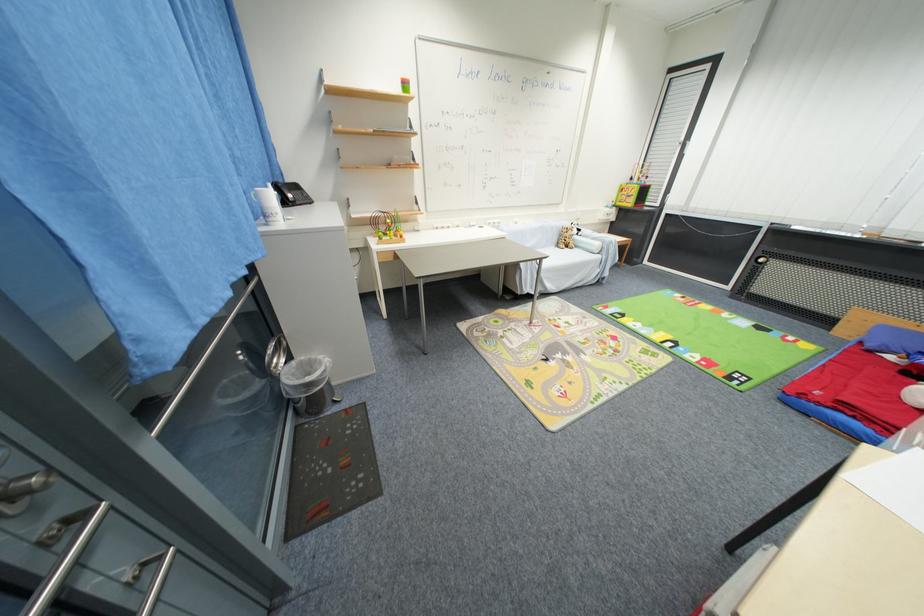
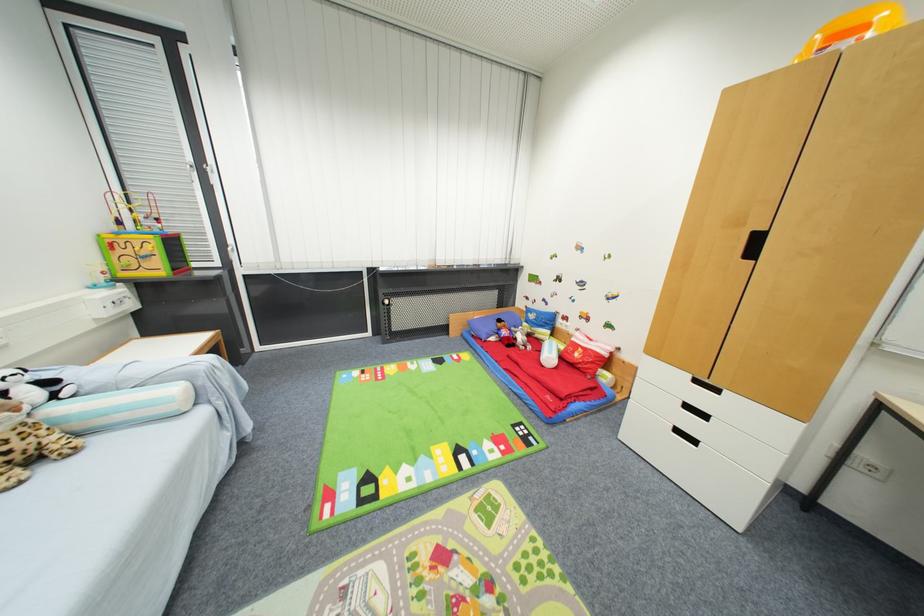
Locate, in the second image, the point that corresponds to point (686, 351) in the first image.

(479, 455)